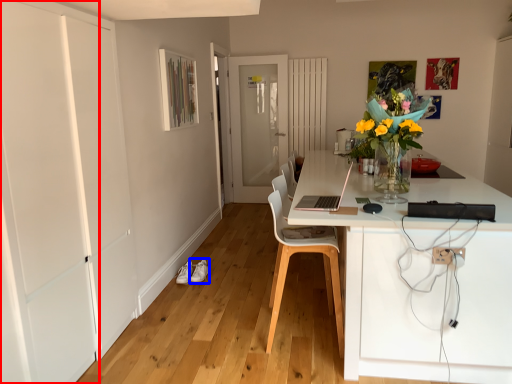
Question: Which of the following is the farthest to the observer, door (highlighted by a red box) or shoe (highlighted by a blue box)?

Choices:
 (A) door
 (B) shoe

Answer: (B)